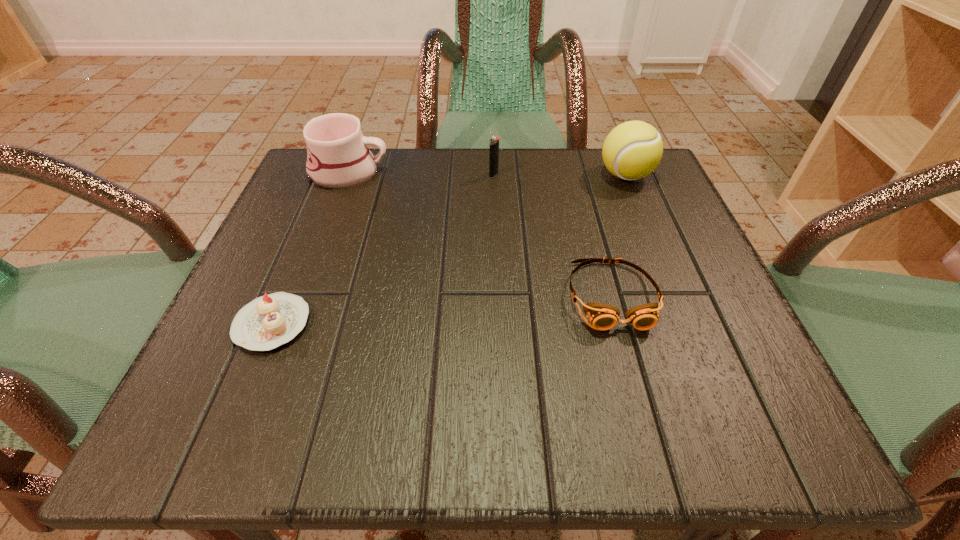
This screenshot has width=960, height=540. I want to click on vacant region that satisfies the following two spatial constraints: 1. on the side with the handle of the mug; 2. on the back side of the tennis ball, so (x=348, y=176).